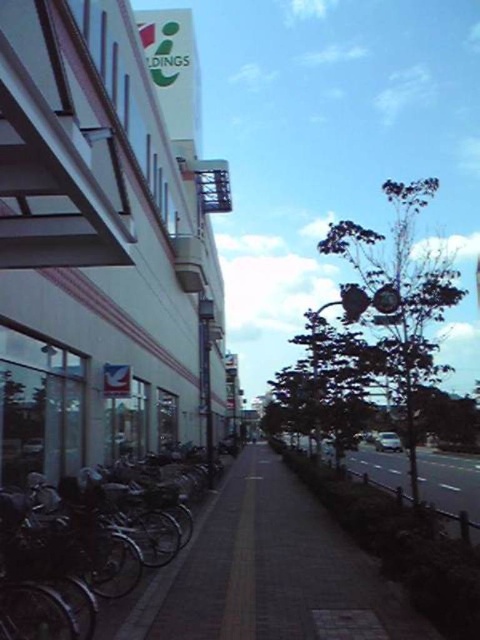
Who is more forward, (47, 582) or (224, 628)?

Point (47, 582)

Can you confirm if silver metallic bicycle at left is taller than smooth asphalt road at center?

No.

Locate an element on the screen. silver metallic bicycle at left is located at coordinates (69, 557).

The height and width of the screenshot is (640, 480). What are the coordinates of `silver metallic bicycle at left` in the screenshot? It's located at (x=69, y=557).

Can you confirm if brick paved sidewalk at center is bigger than smooth asphalt road at center?

Correct, brick paved sidewalk at center is larger in size than smooth asphalt road at center.

Does brick paved sidewalk at center appear under smooth asphalt road at center?

Actually, brick paved sidewalk at center is above smooth asphalt road at center.

I want to click on brick paved sidewalk at center, so click(271, 570).

Is brick paved sidewalk at center to the right of silver metallic bicycle at left from the viewer's perspective?

Correct, you'll find brick paved sidewalk at center to the right of silver metallic bicycle at left.

Which is in front, point (127, 624) or point (33, 538)?

Point (33, 538) is more forward.

Who is more distant from viewer, (324, 625) or (78, 593)?

The point (324, 625) is behind.

Locate an element on the screen. Image resolution: width=480 pixels, height=640 pixels. brick paved sidewalk at center is located at coordinates (271, 570).